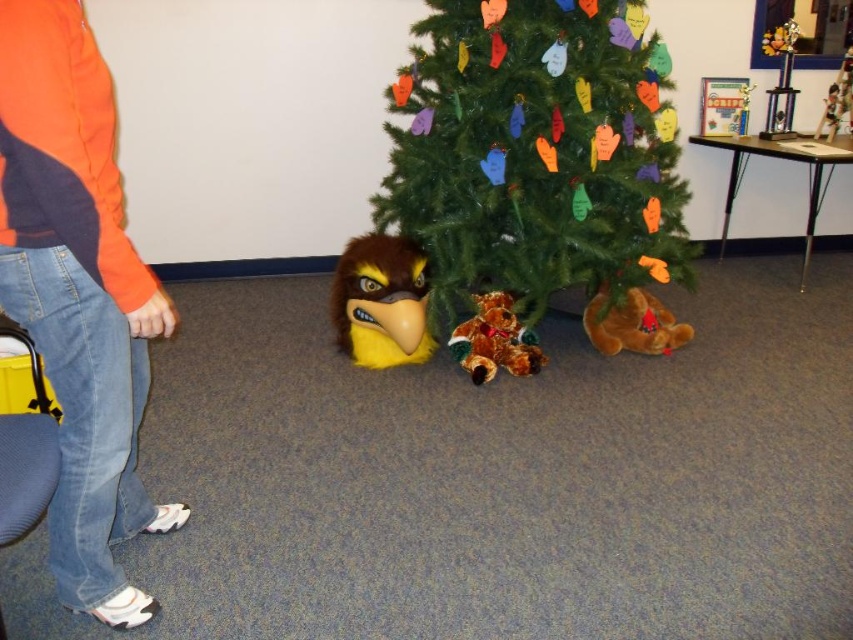
Question: Which object is farther from the camera taking this photo?

Choices:
 (A) green matte christmas tree at center
 (B) orange fleece jacket at upper left
 (C) orange plush toy at lower right

Answer: (C)

Question: Does orange fleece jacket at upper left have a smaller size compared to orange plush toy at lower right?

Choices:
 (A) yes
 (B) no

Answer: (B)

Question: Among these objects, which one is nearest to the camera?

Choices:
 (A) orange fleece jacket at upper left
 (B) yellow plush eagle at lower center
 (C) green matte christmas tree at center
 (D) fuzzy brown teddy bear at center

Answer: (A)

Question: Is green matte christmas tree at center further to camera compared to orange plush toy at lower right?

Choices:
 (A) yes
 (B) no

Answer: (B)

Question: Is green matte christmas tree at center to the left of fuzzy brown teddy bear at center from the viewer's perspective?

Choices:
 (A) no
 (B) yes

Answer: (A)

Question: Which of these objects is positioned closest to the orange fleece jacket at upper left?

Choices:
 (A) yellow plush eagle at lower center
 (B) green matte christmas tree at center
 (C) orange plush toy at lower right
 (D) fuzzy brown teddy bear at center

Answer: (A)